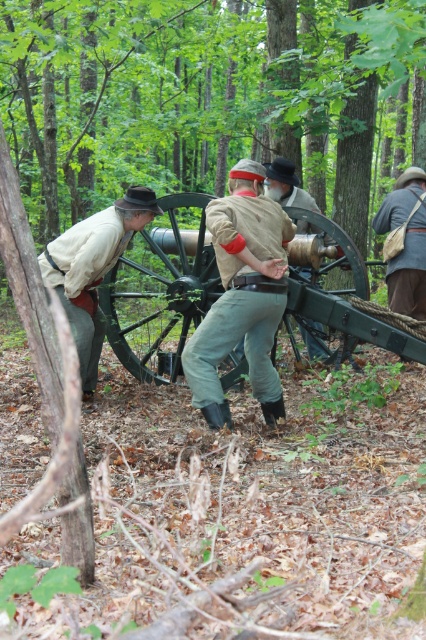
Question: Which point appears farthest from the camera in this image?

Choices:
 (A) (143, 314)
 (B) (414, 228)
 (C) (290, 195)
 (D) (287, 276)

Answer: (A)

Question: Does light brown leather pants at center come behind light brown leather jacket at center?

Choices:
 (A) no
 (B) yes

Answer: (A)

Question: Does light brown leather pants at center have a greater width compared to light brown leather jacket at center?

Choices:
 (A) no
 (B) yes

Answer: (B)

Question: Which of the following is the closest to the observer?

Choices:
 (A) black matte cannon at center
 (B) light brown leather jacket at center

Answer: (A)

Question: Can you confirm if light brown leather pants at center is positioned to the left of light brown leather jacket at center?

Choices:
 (A) yes
 (B) no

Answer: (A)

Question: Which of the following is the farthest from the observer?

Choices:
 (A) black matte cannon at center
 (B) light brown leather hat at left

Answer: (A)